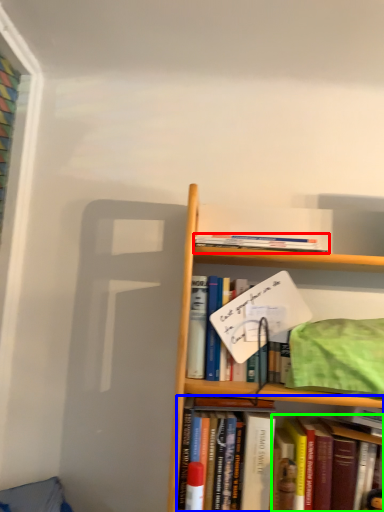
Question: Considering the real-world distances, which object is closest to book (highlighted by a red box)? book (highlighted by a blue box) or book (highlighted by a green box).

Choices:
 (A) book
 (B) book

Answer: (A)